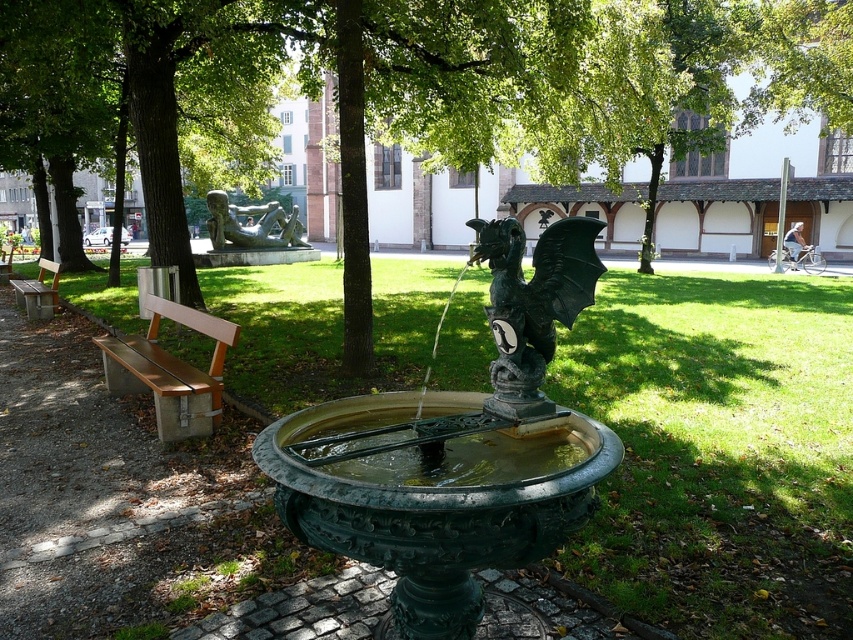
Question: Estimate the real-world distances between objects in this image. Which object is farther from the green patinated metal dragon fountain at center?

Choices:
 (A) brown wood bench at left
 (B) green leafy tree at center

Answer: (B)

Question: Which object is closer to the camera taking this photo?

Choices:
 (A) green patinated metal dragon fountain at center
 (B) green leafy tree at center
 (C) wooden bench at left

Answer: (A)

Question: Which of these objects is positioned closest to the brown wood bench at left?

Choices:
 (A) green patinated metal dragon fountain at center
 (B) green leafy tree at center

Answer: (A)

Question: Does green patinated metal dragon fountain at center have a lesser width compared to brown wood bench at left?

Choices:
 (A) no
 (B) yes

Answer: (B)

Question: Can you confirm if green polished stone dragon at center is positioned to the right of brown wood bench at left?

Choices:
 (A) yes
 (B) no

Answer: (A)

Question: Does green leafy tree at center appear under green polished stone dragon at center?

Choices:
 (A) no
 (B) yes

Answer: (A)